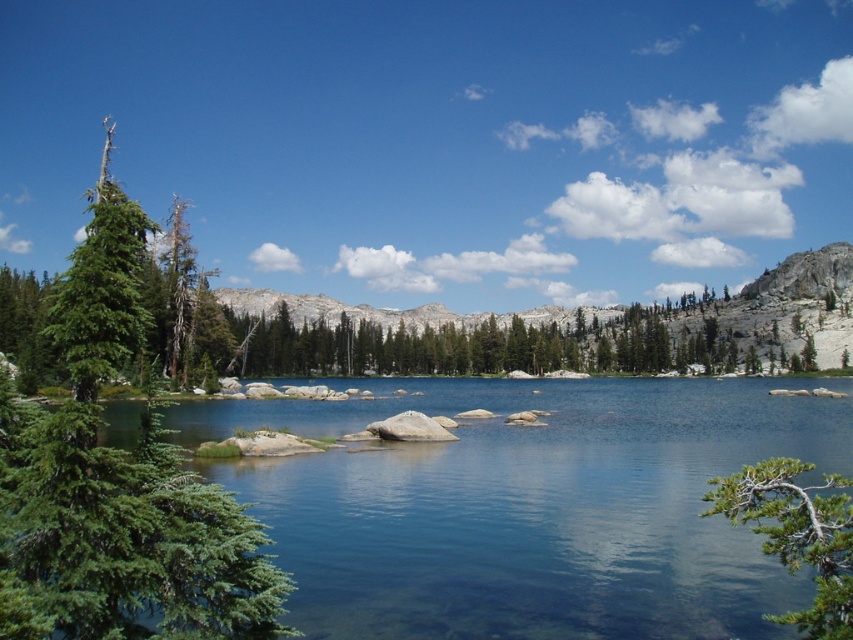
Question: Is green needle-like tree at left below green textured branch at lower right?

Choices:
 (A) yes
 (B) no

Answer: (B)

Question: Is green needle-like tree at left thinner than green textured branch at lower right?

Choices:
 (A) no
 (B) yes

Answer: (B)

Question: Which object is positioned closest to the green textured branch at lower right?

Choices:
 (A) green needle-like tree at left
 (B) clear water at center

Answer: (B)

Question: Can you confirm if clear water at center is thinner than green needle-like tree at left?

Choices:
 (A) no
 (B) yes

Answer: (A)

Question: Among these points, which one is nearest to the camera?

Choices:
 (A) (213, 531)
 (B) (834, 630)

Answer: (B)

Question: Which object is the farthest from the green needle-like tree at left?

Choices:
 (A) clear water at center
 (B) green textured branch at lower right

Answer: (A)